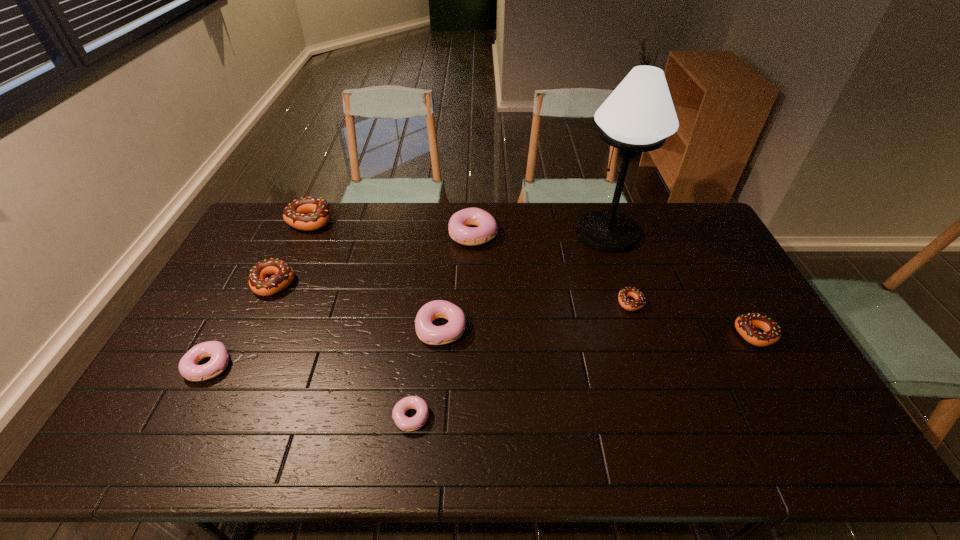
What are the coordinates of `vacant region at the near left corner` in the screenshot? It's located at click(x=143, y=442).

What are the coordinates of `vacant space at the far right corner of the desktop` in the screenshot? It's located at (700, 216).

You are a GUI agent. You are given a task and a screenshot of the screen. Output one action in this format:
    pyautogui.click(x=<x>, y=<y>)
    Task: Click on the blank region between the biggest brown doughnut and the nearest object
    Image resolution: width=960 pixels, height=540 pixels.
    Given the screenshot: What is the action you would take?
    pyautogui.click(x=360, y=319)

What are the coordinates of `empty space that is in between the second biggest brown doughnut and the seventh doughnut from left to right` in the screenshot? It's located at [x=452, y=293].

In order to click on free space between the smallest purple doughnut and the biggest brown doughnut in this screenshot , I will do `click(360, 319)`.

You are a GUI agent. You are given a task and a screenshot of the screen. Output one action in this format:
    pyautogui.click(x=<x>, y=<y>)
    Task: Click on the free space between the third smallest purple doughnut and the smallest brown doughnut
    The height and width of the screenshot is (540, 960).
    Given the screenshot: What is the action you would take?
    pyautogui.click(x=536, y=315)

The image size is (960, 540). Find the location of `unoccupied position between the leftmost purple doughnut and the nearest doughnut`. unoccupied position between the leftmost purple doughnut and the nearest doughnut is located at coordinates (310, 392).

Where is `vacant area that lies between the farthest purple doughnut and the tallest object`? vacant area that lies between the farthest purple doughnut and the tallest object is located at coordinates (540, 233).

Identify the location of vacant area that lies between the second smallest brown doughnut and the third smallest brown doughnut. The height and width of the screenshot is (540, 960). (515, 309).

You are a GUI agent. You are given a task and a screenshot of the screen. Output one action in this format:
    pyautogui.click(x=<x>, y=<y>)
    Task: Click on the vacant region between the nearest brown doughnut and the biggest brown doughnut
    The width and height of the screenshot is (960, 540).
    Given the screenshot: What is the action you would take?
    pyautogui.click(x=533, y=278)